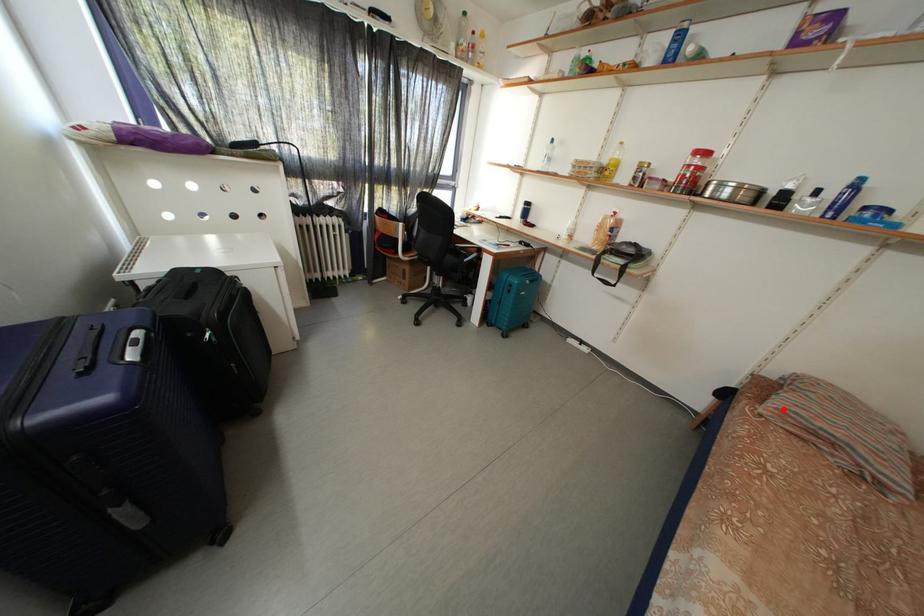
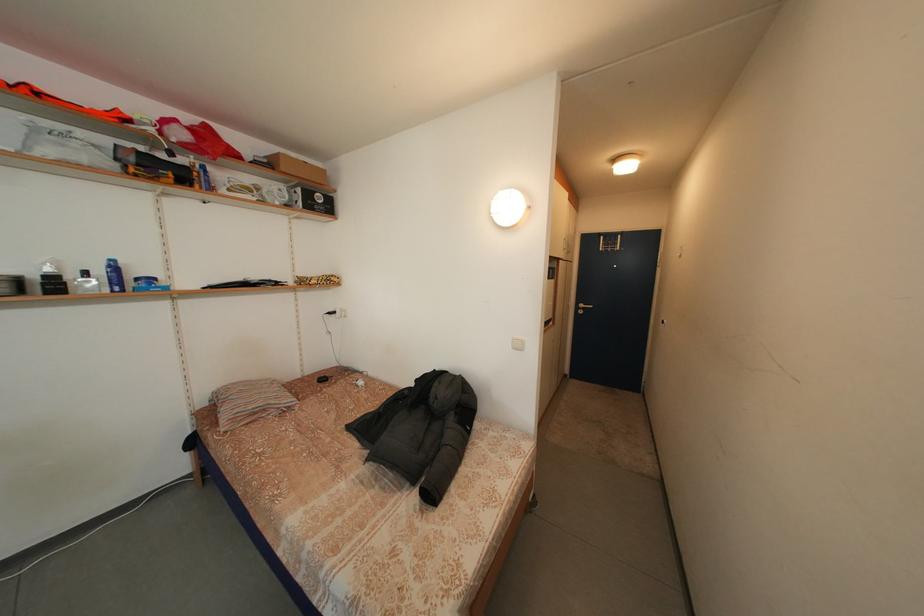
Locate, in the second image, the point that corresponds to the highlighted location in the first image.

(233, 424)